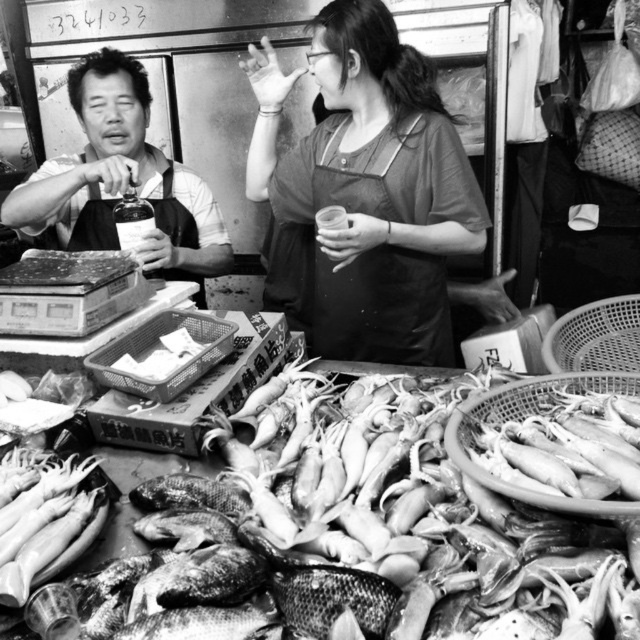
You are a customer at the fish market and want to approach both the smooth apron at left and the black fabric apron at center. Which apron should you walk towards first to reach the one on the left side?

The smooth apron at left is to the left of the black fabric apron at center, so you should walk towards the smooth apron at left first to reach the one on the left side.

You are a photographer standing at the fish market. You want to take a closeup photo of the matte apron at center. The camera you are using has a minimum focusing distance of 5 feet. Will you be able to take the photo without moving closer?

The matte apron at center is 5.08 feet away from the camera. Since the minimum focusing distance is 5 feet, you are just slightly beyond the required distance. To take the closeup, you might need to move about 0.08 feet closer or adjust your camera settings if possible.